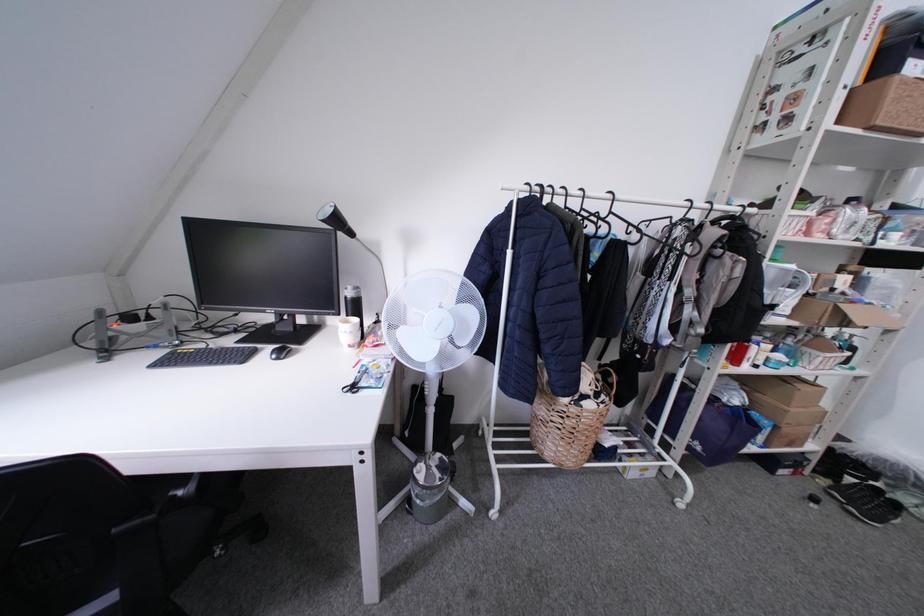
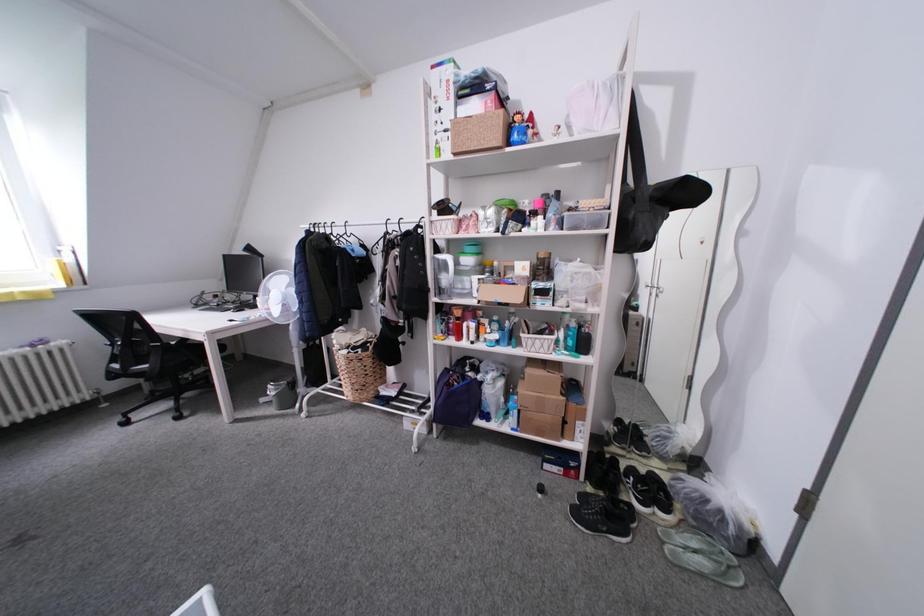
Question: Which direction would the cameraman need to move to produce the second image? Reply with the corresponding letter.

Choices:
 (A) Left
 (B) Right
 (C) Forward
 (D) Backward

Answer: (B)